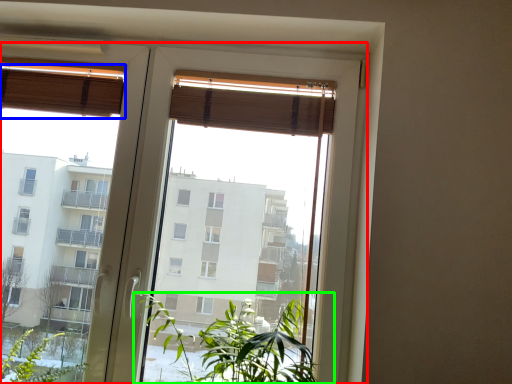
Question: Which object is the closest to the window (highlighted by a red box)? Choose among these: curtain (highlighted by a blue box) or houseplant (highlighted by a green box).

Choices:
 (A) curtain
 (B) houseplant

Answer: (A)